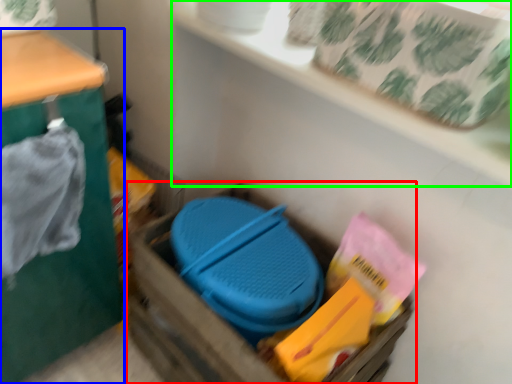
Question: Based on their relative distances, which object is nearer to storage box (highlighted by a red box)? Choose from furniture (highlighted by a blue box) and shelf (highlighted by a green box).

Choices:
 (A) furniture
 (B) shelf

Answer: (A)